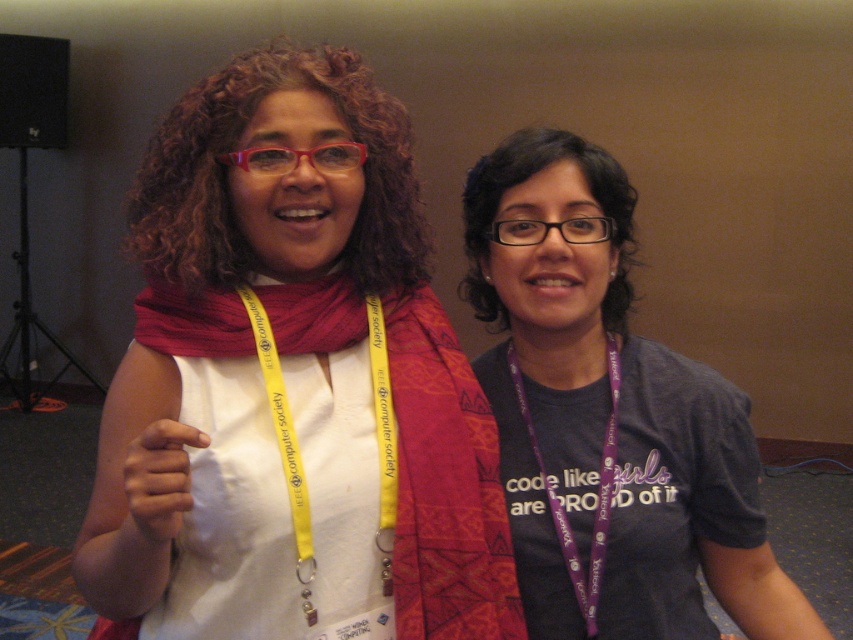
Between point (138, 195) and point (589, 618), which one is positioned behind?

Positioned behind is point (589, 618).

Is matte white scarf at center thinner than purple fabric lanyard at center?

No.

Between point (264, 330) and point (582, 593), which one is positioned behind?

Point (582, 593)

You are a GUI agent. You are given a task and a screenshot of the screen. Output one action in this format:
    pyautogui.click(x=<x>, y=<y>)
    Task: Click on the matte white scarf at center
    Image resolution: width=853 pixels, height=640 pixels.
    Given the screenshot: What is the action you would take?
    pyautogui.click(x=292, y=388)

Is yellow fabric lanyard at center taller than translucent plastic glasses at center?

Correct, yellow fabric lanyard at center is much taller as translucent plastic glasses at center.

Can you confirm if yellow fabric lanyard at center is positioned to the left of translucent plastic glasses at center?

Incorrect, yellow fabric lanyard at center is not on the left side of translucent plastic glasses at center.

Who is more forward, [386,496] or [289,164]?

Positioned in front is point [289,164].

Locate an element on the screen. The width and height of the screenshot is (853, 640). yellow fabric lanyard at center is located at coordinates (305, 477).

How far apart are matte white scarf at center and purple lanyard at center?

They are 10.22 inches apart.

What are the coordinates of `matte white scarf at center` in the screenshot? It's located at (292, 388).

Identify the location of matte white scarf at center. (292, 388).

Identify the location of matte white scarf at center. pos(292,388).